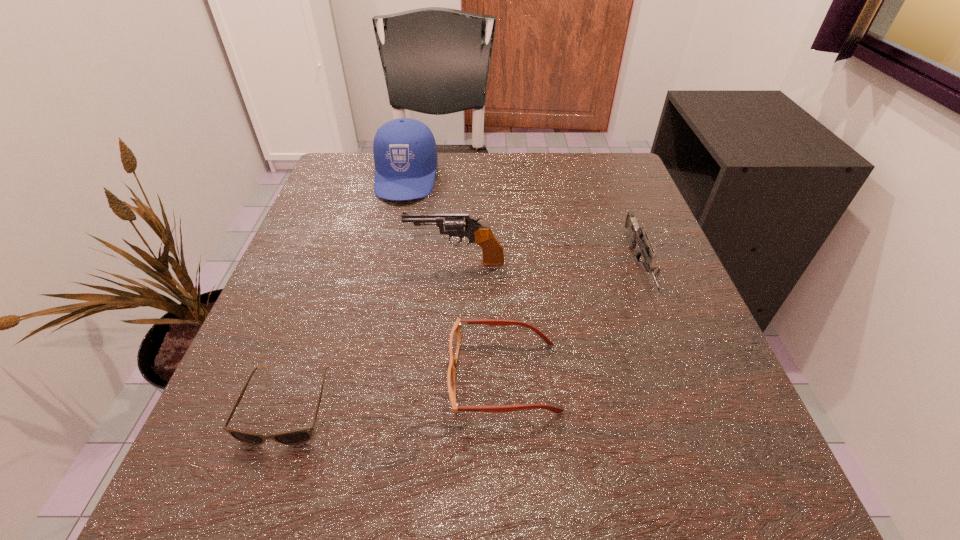
The height and width of the screenshot is (540, 960). In the image, there is a desktop. Find the location of `vacant area at the far edge`. vacant area at the far edge is located at coordinates (497, 203).

Find the location of a particular element. blank area at the near edge is located at coordinates (574, 465).

You are a GUI agent. You are given a task and a screenshot of the screen. Output one action in this format:
    pyautogui.click(x=<x>, y=<y>)
    Task: Click on the vacant space at the left edge of the desktop
    The width and height of the screenshot is (960, 540).
    Given the screenshot: What is the action you would take?
    pyautogui.click(x=281, y=448)

You are a GUI agent. You are given a task and a screenshot of the screen. Output one action in this format:
    pyautogui.click(x=<x>, y=<y>)
    Task: Click on the vacant region at the right edge of the desktop
    The image size is (960, 540).
    Given the screenshot: What is the action you would take?
    pyautogui.click(x=650, y=409)

Find the location of a particular element. The height and width of the screenshot is (540, 960). free region at the far left corner of the desktop is located at coordinates (338, 175).

The height and width of the screenshot is (540, 960). In the image, there is a desktop. Identify the location of vacant space at the near left corner. (273, 455).

Locate an element on the screen. This screenshot has height=540, width=960. vacant area at the far right corner is located at coordinates (603, 172).

Locate an element on the screen. This screenshot has width=960, height=540. vacant space at the near right corner of the desktop is located at coordinates (682, 482).

Find the location of a particular element. The image size is (960, 540). free point between the right gun and the left gun is located at coordinates (547, 264).

Locate an element on the screen. This screenshot has height=540, width=960. vacant point located between the second shortest object and the shortest object is located at coordinates (396, 392).